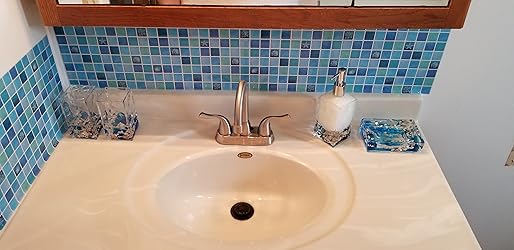
Image resolution: width=514 pixels, height=250 pixels. In order to click on handles in this screenshot , I will do `click(222, 123)`, `click(266, 122)`.